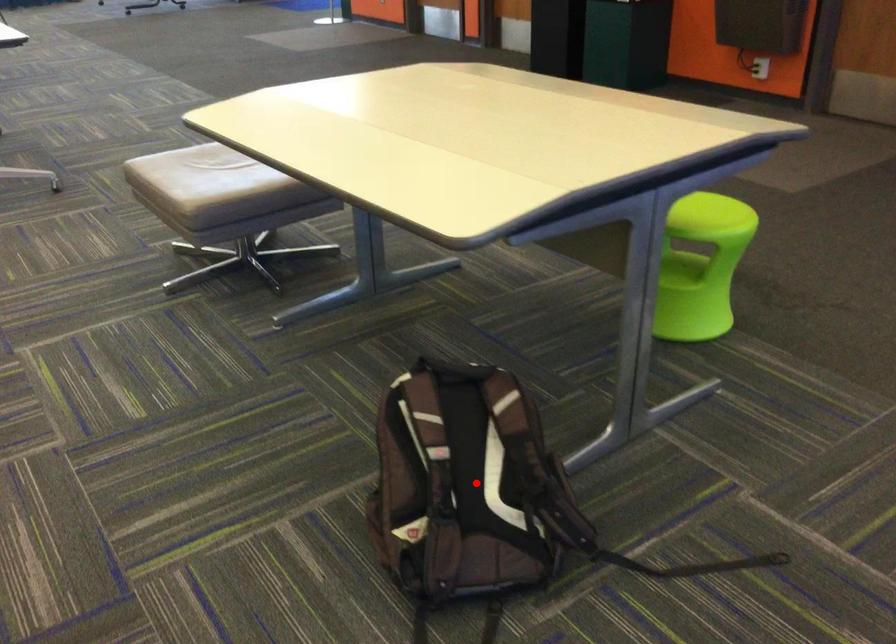
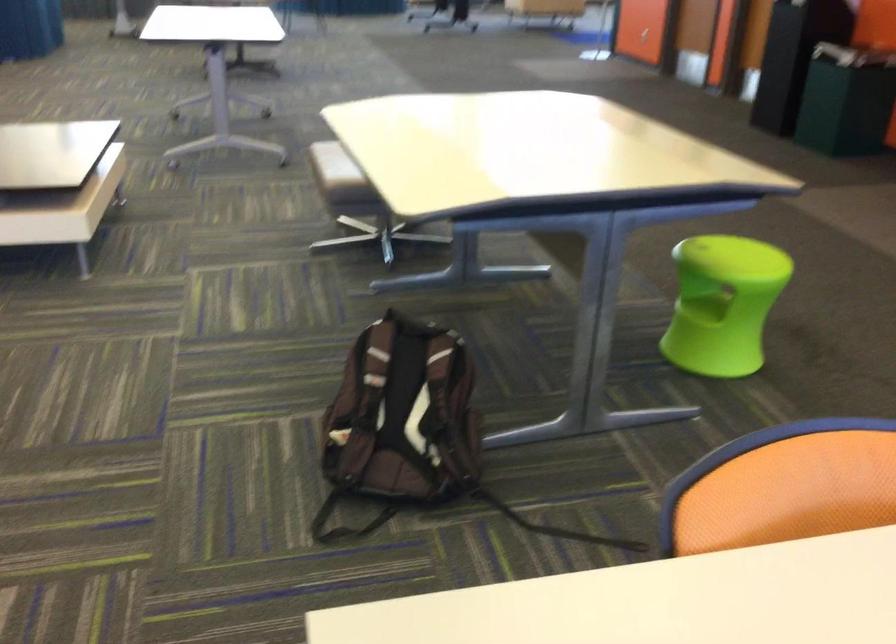
Locate, in the second image, the point that corresponds to the highlighted location in the first image.

(402, 413)